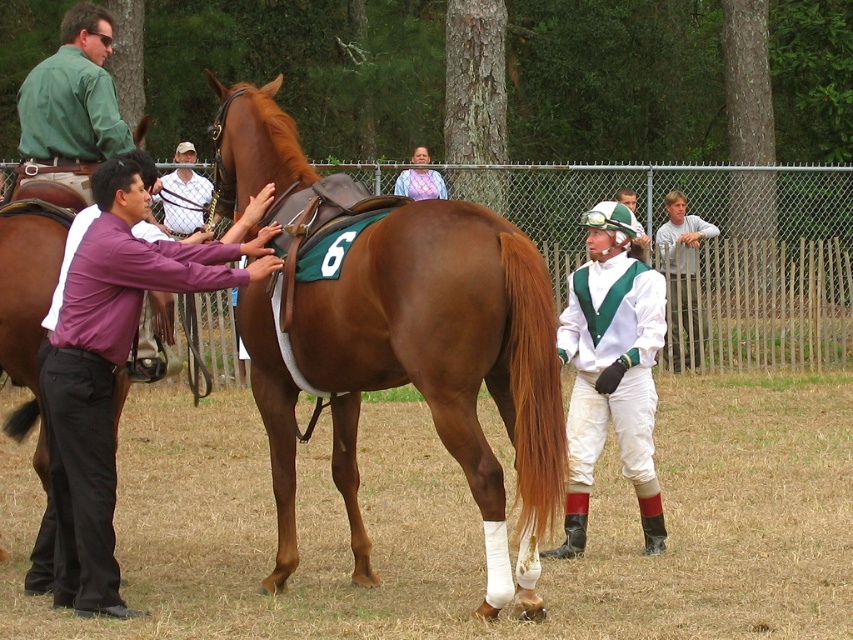
Is point (440, 416) farther from viewer compared to point (422, 156)?

No, (440, 416) is closer to viewer.

Locate an element on the screen. This screenshot has width=853, height=640. shiny brown horse at center is located at coordinates click(x=397, y=336).

Which is behind, point (260, 173) or point (51, 177)?

The point (260, 173) is behind.

Which is above, shiny brown horse at center or green smooth shirt at upper left?

green smooth shirt at upper left is higher up.

Is point (234, 134) behind point (103, 83)?

That is True.

You are a GUI agent. You are given a task and a screenshot of the screen. Output one action in this format:
    pyautogui.click(x=<x>, y=<y>)
    Task: Click on the shiny brown horse at center
    The image size is (853, 640).
    Given the screenshot: What is the action you would take?
    pyautogui.click(x=397, y=336)

Who is lower down, green smooth shirt at upper left or brown glossy saddle at left?

Positioned lower is brown glossy saddle at left.

Does green smooth shirt at upper left have a greater height compared to brown glossy saddle at left?

Incorrect, green smooth shirt at upper left's height is not larger of brown glossy saddle at left's.

Is point (27, 113) closer to viewer compared to point (1, 248)?

No, it is not.

Find the location of a particular element. This screenshot has height=640, width=853. green smooth shirt at upper left is located at coordinates (73, 100).